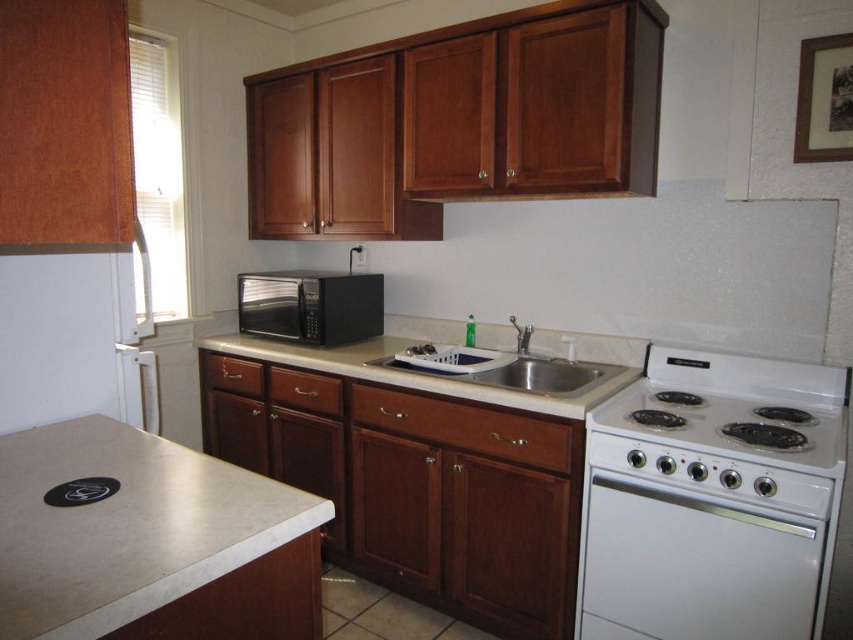
Does white glossy electric stove at right have a lesser height compared to stainless steel sink at center?

Incorrect, white glossy electric stove at right's height does not fall short of stainless steel sink at center's.

Does point (831, 451) lie behind point (608, 353)?

That is False.

The image size is (853, 640). In order to click on white glossy electric stove at right in this screenshot , I will do `click(711, 500)`.

Between white marble countertop at center and black matte microwave at center, which one appears on the right side from the viewer's perspective?

Positioned to the right is white marble countertop at center.

In the scene shown: Does white marble countertop at center have a greater width compared to black matte microwave at center?

Yes.

Does point (404, 317) come in front of point (337, 316)?

That is False.

At what (x,y) coordinates should I click in order to perform the action: click on white marble countertop at center. Please return your answer as a coordinate pair (x, y). The width and height of the screenshot is (853, 640). Looking at the image, I should click on (473, 372).

Who is positioned more to the right, white glossy electric stove at right or black matte microwave at center?

white glossy electric stove at right

Measure the distance between white glossy electric stove at right and black matte microwave at center.

white glossy electric stove at right and black matte microwave at center are 1.32 meters apart from each other.

The image size is (853, 640). I want to click on white glossy electric stove at right, so click(x=711, y=500).

This screenshot has height=640, width=853. What are the coordinates of `white glossy electric stove at right` in the screenshot? It's located at (711, 500).